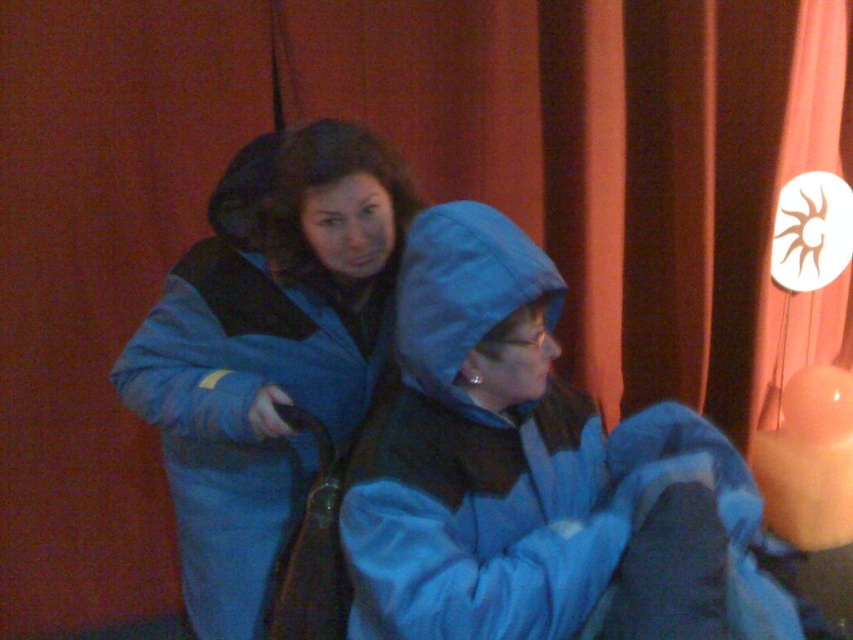
Question: Is blue fleece jacket at center positioned in front of blue fuzzy coat at center?

Choices:
 (A) no
 (B) yes

Answer: (B)

Question: Can you confirm if blue fleece jacket at center is positioned below blue fuzzy coat at center?

Choices:
 (A) yes
 (B) no

Answer: (A)

Question: Which point is farther to the camera?

Choices:
 (A) blue fleece jacket at center
 (B) blue fuzzy coat at center

Answer: (B)

Question: Can you confirm if blue fleece jacket at center is positioned above blue fuzzy coat at center?

Choices:
 (A) yes
 (B) no

Answer: (B)